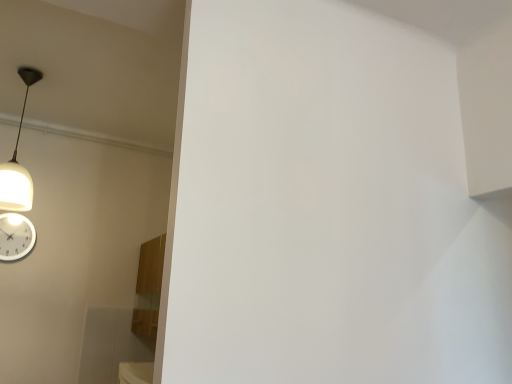
The image size is (512, 384). What do you see at coordinates (17, 162) in the screenshot?
I see `white matte lampshade at upper left` at bounding box center [17, 162].

This screenshot has width=512, height=384. I want to click on white matte lampshade at upper left, so (17, 162).

What do you see at coordinates (15, 237) in the screenshot?
I see `white glossy wall clock at lower left` at bounding box center [15, 237].

Find the location of `white glossy wall clock at lower left`. white glossy wall clock at lower left is located at coordinates (15, 237).

The image size is (512, 384). Find the location of `white matte lampshade at upper left`. white matte lampshade at upper left is located at coordinates (17, 162).

Considering the relative positions of white glossy wall clock at lower left and white matte lampshade at upper left in the image provided, is white glossy wall clock at lower left to the right of white matte lampshade at upper left from the viewer's perspective?

No, white glossy wall clock at lower left is not to the right of white matte lampshade at upper left.

Is white glossy wall clock at lower left behind white matte lampshade at upper left?

Yes, it is.

Which is further, (27, 220) or (18, 70)?

Point (27, 220)

From the image's perspective, is white glossy wall clock at lower left above or below white matte lampshade at upper left?

white glossy wall clock at lower left is situated lower than white matte lampshade at upper left in the image.

From a real-world perspective, relative to white matte lampshade at upper left, is white glossy wall clock at lower left vertically above or below?

Clearly, from a real-world perspective, white glossy wall clock at lower left is below white matte lampshade at upper left.

Which object is thinner, white glossy wall clock at lower left or white matte lampshade at upper left?

white glossy wall clock at lower left.

Which of these two, white glossy wall clock at lower left or white matte lampshade at upper left, stands shorter?

With less height is white glossy wall clock at lower left.

Between white glossy wall clock at lower left and white matte lampshade at upper left, which one has smaller size?

white glossy wall clock at lower left is smaller.

Is white glossy wall clock at lower left positioned beyond the bounds of white matte lampshade at upper left?

Yes.

Is white glossy wall clock at lower left far away from white matte lampshade at upper left?

That's not correct — white glossy wall clock at lower left is a little close to white matte lampshade at upper left.

Is white glossy wall clock at lower left aimed at white matte lampshade at upper left?

No, white glossy wall clock at lower left is not oriented towards white matte lampshade at upper left.

You are a GUI agent. You are given a task and a screenshot of the screen. Output one action in this format:
    pyautogui.click(x=<x>, y=<y>)
    Task: Click on the wall clock below the white matte lampshade at upper left (from the image's perspective)
    This screenshot has width=512, height=384.
    Given the screenshot: What is the action you would take?
    tap(15, 237)

Which object is positioned more to the right, white matte lampshade at upper left or white glossy wall clock at lower left?

white matte lampshade at upper left is more to the right.

Is the depth of white matte lampshade at upper left less than that of white glossy wall clock at lower left?

Yes, white matte lampshade at upper left is closer to the camera.

Considering the points (19, 207) and (0, 221), which point is in front, point (19, 207) or point (0, 221)?

The point (19, 207) is closer to the camera.

From the image's perspective, is white matte lampshade at upper left positioned above or below white glossy wall clock at lower left?

white matte lampshade at upper left is situated higher than white glossy wall clock at lower left in the image.

From a real-world perspective, is white matte lampshade at upper left positioned above or below white glossy wall clock at lower left?

Clearly, from a real-world perspective, white matte lampshade at upper left is above white glossy wall clock at lower left.

Consider the image. Considering the relative sizes of white matte lampshade at upper left and white glossy wall clock at lower left in the image provided, is white matte lampshade at upper left wider than white glossy wall clock at lower left?

Correct, the width of white matte lampshade at upper left exceeds that of white glossy wall clock at lower left.

In terms of height, does white matte lampshade at upper left look taller or shorter compared to white glossy wall clock at lower left?

white matte lampshade at upper left is taller than white glossy wall clock at lower left.

Which of these two, white matte lampshade at upper left or white glossy wall clock at lower left, is smaller?

white glossy wall clock at lower left is smaller.

Is white matte lampshade at upper left not inside white glossy wall clock at lower left?

Yes, white matte lampshade at upper left is not within white glossy wall clock at lower left.

Is white matte lampshade at upper left next to white glossy wall clock at lower left and touching it?

white matte lampshade at upper left is not next to white glossy wall clock at lower left, and they're not touching.

Could you tell me if white matte lampshade at upper left is facing white glossy wall clock at lower left?

No, white matte lampshade at upper left is not oriented towards white glossy wall clock at lower left.

What's the angular difference between white matte lampshade at upper left and white glossy wall clock at lower left's facing directions?

There is a 3.18-degree angle between the facing directions of white matte lampshade at upper left and white glossy wall clock at lower left.

How much distance is there between white matte lampshade at upper left and white glossy wall clock at lower left?

39.73 centimeters.

You are a GUI agent. You are given a task and a screenshot of the screen. Output one action in this format:
    pyautogui.click(x=<x>, y=<y>)
    Task: Click on the lamp above the white glossy wall clock at lower left (from a real-world perspective)
    This screenshot has width=512, height=384.
    Given the screenshot: What is the action you would take?
    pyautogui.click(x=17, y=162)

You are a GUI agent. You are given a task and a screenshot of the screen. Output one action in this format:
    pyautogui.click(x=<x>, y=<y>)
    Task: Click on the wall clock located behind the white matte lampshade at upper left
    The width and height of the screenshot is (512, 384).
    Given the screenshot: What is the action you would take?
    pyautogui.click(x=15, y=237)

The height and width of the screenshot is (384, 512). In order to click on lamp above the white glossy wall clock at lower left (from a real-world perspective) in this screenshot , I will do `click(17, 162)`.